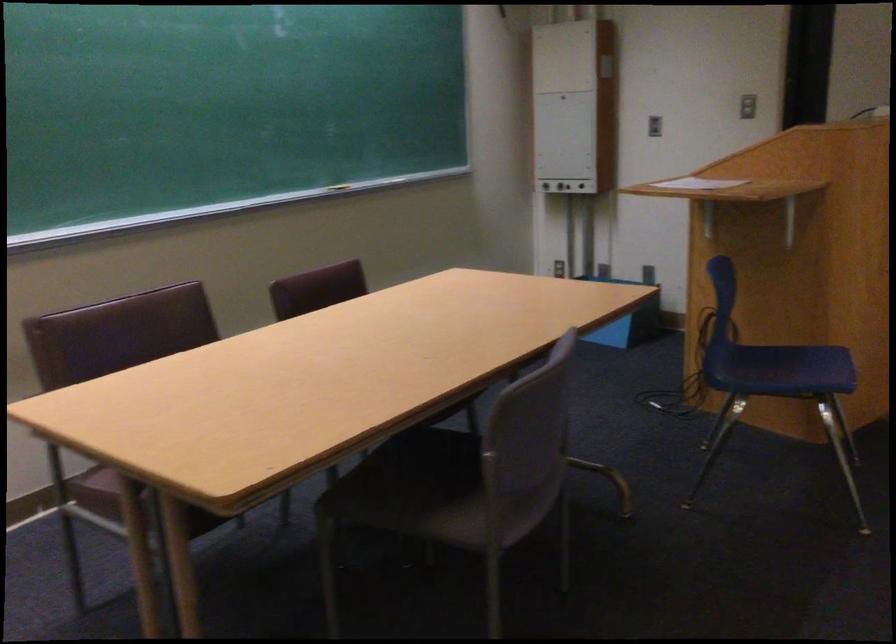
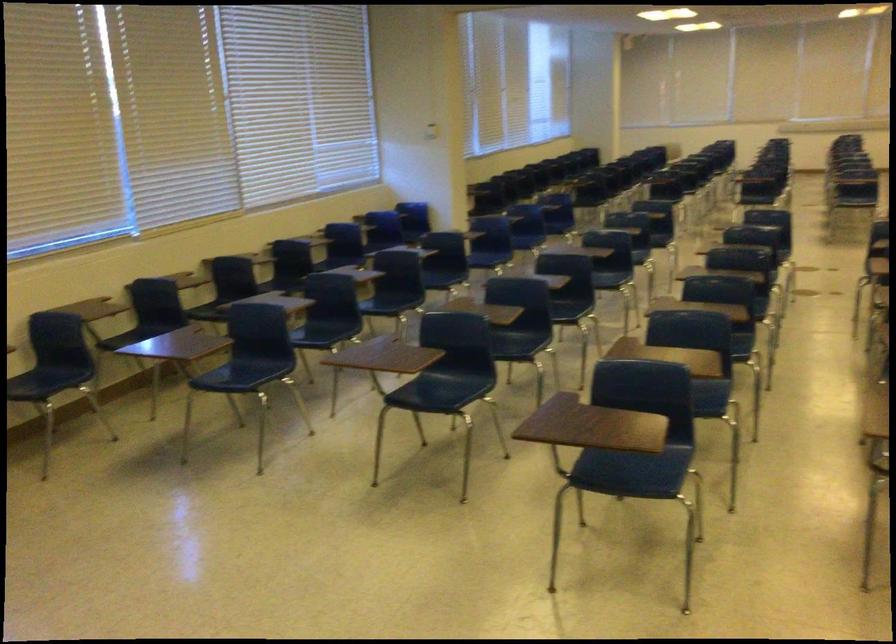
The images are taken continuously from a first-person perspective. In which direction is your viewpoint rotating?

The camera rotated toward right-down.